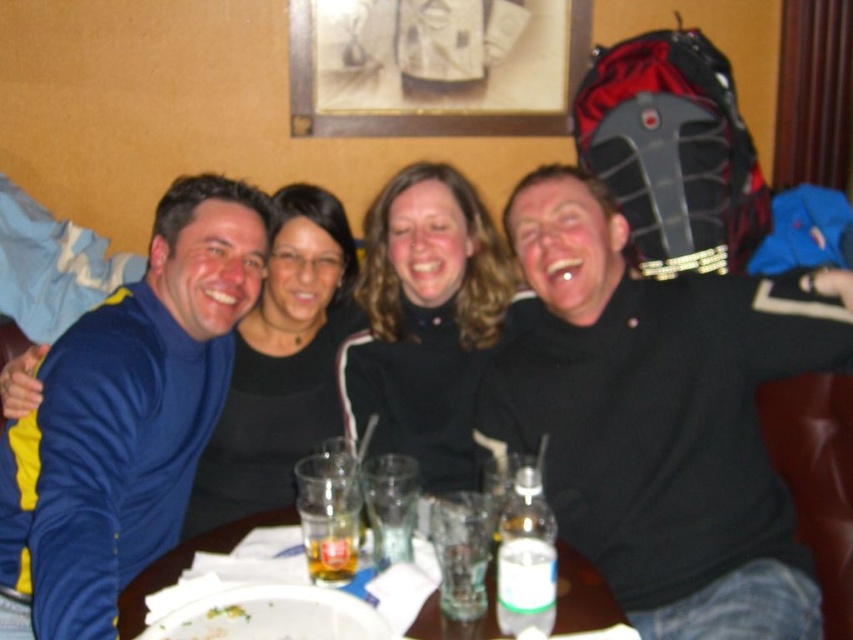
Who is more forward, [720,541] or [12,449]?

Point [720,541] is more forward.

Can you confirm if black textured sweater at right is smaller than blue fleece jacket at left?

Correct, black textured sweater at right occupies less space than blue fleece jacket at left.

What are the coordinates of `black textured sweater at right` in the screenshot? It's located at (660, 416).

Is the position of black textured sweater at right more distant than that of transparent glassware at center?

Yes, black textured sweater at right is behind transparent glassware at center.

Between black textured sweater at right and transparent glassware at center, which one appears on the left side from the viewer's perspective?

transparent glassware at center is more to the left.

Locate an element on the screen. black textured sweater at right is located at coordinates (660, 416).

Can you confirm if blue fleece jacket at left is positioned below transparent glassware at center?

Actually, blue fleece jacket at left is above transparent glassware at center.

Which is in front, point (158, 440) or point (426, 627)?

Point (426, 627) is in front.

This screenshot has width=853, height=640. Identify the location of blue fleece jacket at left. (131, 412).